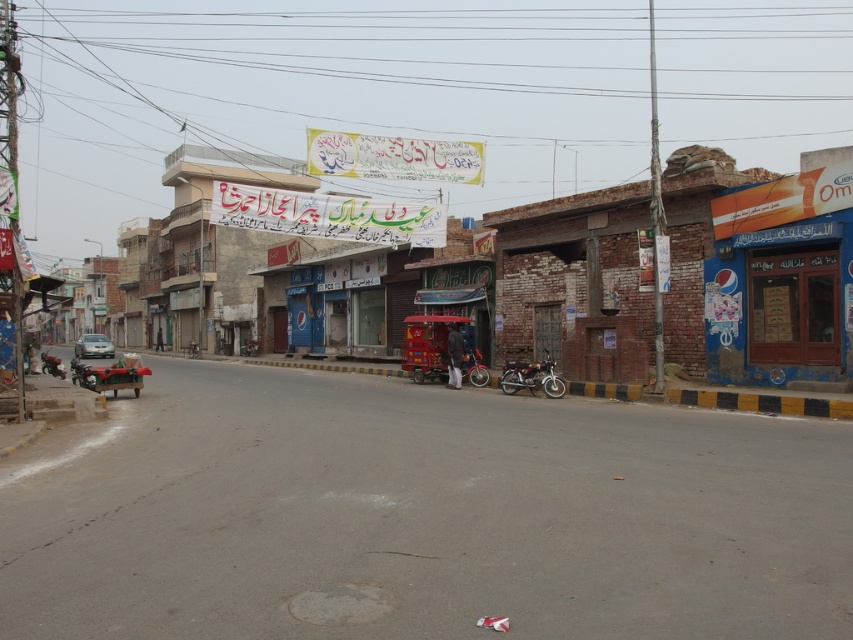
Is metallic red motorcycle at center shorter than silver metallic car at left?

Correct, metallic red motorcycle at center is not as tall as silver metallic car at left.

Locate an element on the screen. metallic red motorcycle at center is located at coordinates (474, 369).

Is point (598, 230) behind point (521, 381)?

Yes.

What do you see at coordinates (459, 288) in the screenshot?
I see `brick wall at center` at bounding box center [459, 288].

What do you see at coordinates (459, 288) in the screenshot?
I see `brick wall at center` at bounding box center [459, 288].

Find the location of a particular element. The width and height of the screenshot is (853, 640). brick wall at center is located at coordinates (459, 288).

Does brick wall at center have a lesser height compared to shiny metallic motorcycle at lower left?

Incorrect, brick wall at center's height does not fall short of shiny metallic motorcycle at lower left's.

Does point (674, 317) come behind point (56, 358)?

No, (674, 317) is closer to viewer.

You are a GUI agent. You are given a task and a screenshot of the screen. Output one action in this format:
    pyautogui.click(x=<x>, y=<y>)
    Task: Click on the brick wall at center
    The height and width of the screenshot is (640, 853).
    Given the screenshot: What is the action you would take?
    pyautogui.click(x=459, y=288)